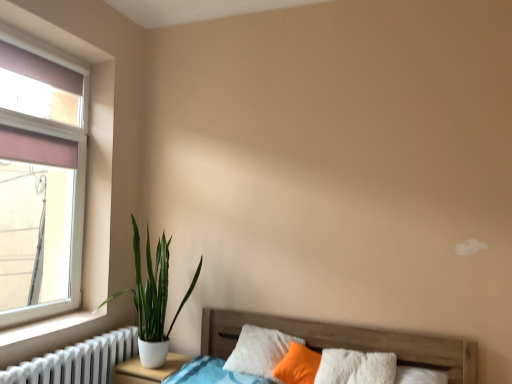
Question: Could white matte nightstand at lower left be considered to be inside white metallic radiator at lower left?

Choices:
 (A) no
 (B) yes

Answer: (A)

Question: From a real-world perspective, is white metallic radiator at lower left located beneath white matte nightstand at lower left?

Choices:
 (A) yes
 (B) no

Answer: (B)

Question: Could you tell me if white metallic radiator at lower left is turned towards white matte nightstand at lower left?

Choices:
 (A) no
 (B) yes

Answer: (A)

Question: Is white metallic radiator at lower left far away from white matte nightstand at lower left?

Choices:
 (A) no
 (B) yes

Answer: (A)

Question: Is white metallic radiator at lower left not inside white matte nightstand at lower left?

Choices:
 (A) yes
 (B) no

Answer: (A)

Question: From the image's perspective, is white metallic radiator at lower left above or below wooden bed at lower left?

Choices:
 (A) below
 (B) above

Answer: (A)

Question: Is point (136, 334) positioned closer to the camera than point (458, 347)?

Choices:
 (A) closer
 (B) farther

Answer: (B)

Question: Considering the positions of white metallic radiator at lower left and wooden bed at lower left in the image, is white metallic radiator at lower left taller or shorter than wooden bed at lower left?

Choices:
 (A) tall
 (B) short

Answer: (B)

Question: From a real-world perspective, is white metallic radiator at lower left positioned above or below wooden bed at lower left?

Choices:
 (A) below
 (B) above

Answer: (A)

Question: From the image's perspective, is white matte nightstand at lower left above or below white smooth window sill at lower left?

Choices:
 (A) below
 (B) above

Answer: (A)

Question: In the image, is white matte nightstand at lower left on the left side or the right side of white smooth window sill at lower left?

Choices:
 (A) right
 (B) left

Answer: (A)

Question: Considering the positions of white matte nightstand at lower left and white smooth window sill at lower left in the image, is white matte nightstand at lower left bigger or smaller than white smooth window sill at lower left?

Choices:
 (A) big
 (B) small

Answer: (A)

Question: Is white matte nightstand at lower left wider or thinner than white smooth window sill at lower left?

Choices:
 (A) thin
 (B) wide

Answer: (B)

Question: Is white ceramic plant at left wider or thinner than white matte nightstand at lower left?

Choices:
 (A) thin
 (B) wide

Answer: (B)

Question: From a real-world perspective, is white ceramic plant at left physically located above or below white matte nightstand at lower left?

Choices:
 (A) above
 (B) below

Answer: (A)